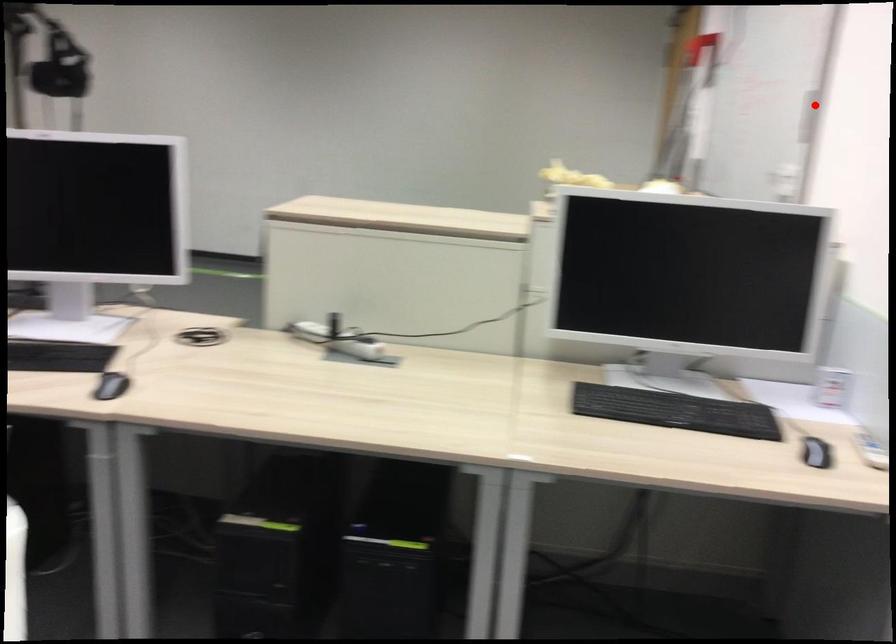
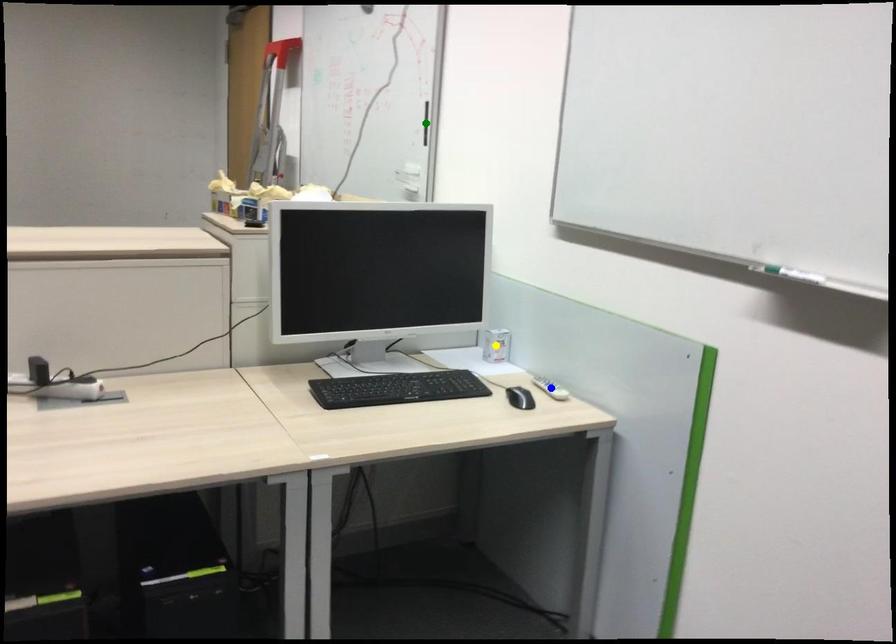
Question: I am providing you with two images of the same scene from different viewpoints. A red point is marked on the first image. You are given multiple points on the second image. Which spot in image 2 lines up with the point in image 1?

Choices:
 (A) blue point
 (B) green point
 (C) yellow point

Answer: (B)